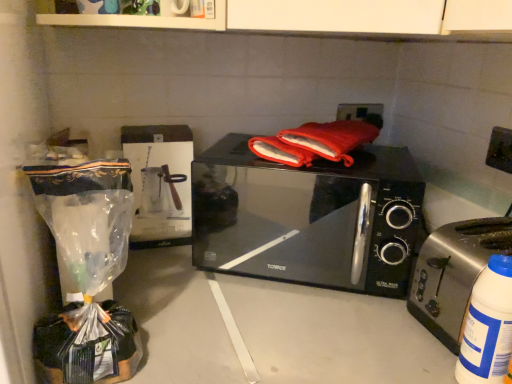
Question: Looking at their shapes, would you say white plastic bottle at lower right is wider or thinner than satin silver toaster at right?

Choices:
 (A) wide
 (B) thin

Answer: (B)

Question: Considering their positions, is white plastic bottle at lower right located in front of or behind satin silver toaster at right?

Choices:
 (A) behind
 (B) front

Answer: (B)

Question: Which of these objects is positioned farthest from the white plastic bottle at lower right?

Choices:
 (A) satin silver toaster at right
 (B) black glossy microwave at center

Answer: (B)

Question: Which is nearer to the white plastic bottle at lower right?

Choices:
 (A) satin silver toaster at right
 (B) black glossy microwave at center

Answer: (A)